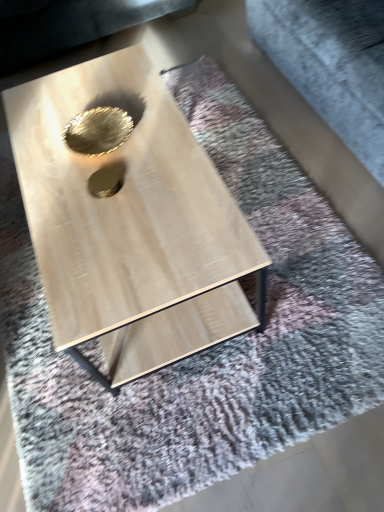
Question: Is gold metallic hole at center, the 2th hole in the back-to-front sequence, located within light wood/texture coffee table at center?

Choices:
 (A) yes
 (B) no

Answer: (A)

Question: From a real-world perspective, is light wood/texture coffee table at center physically above gold metallic hole at center, which is the second hole in top-to-bottom order?

Choices:
 (A) no
 (B) yes

Answer: (A)

Question: Is light wood/texture coffee table at center placed right next to gold metallic hole at center, placed as the 1th hole when sorted from bottom to top?

Choices:
 (A) yes
 (B) no

Answer: (B)

Question: Does light wood/texture coffee table at center appear on the right side of gold metallic hole at center, placed as the 1th hole when sorted from bottom to top?

Choices:
 (A) no
 (B) yes

Answer: (B)

Question: Is light wood/texture coffee table at center taller than gold metallic hole at center, which is the second hole in top-to-bottom order?

Choices:
 (A) yes
 (B) no

Answer: (A)

Question: From a real-world perspective, is light wood/texture coffee table at center located beneath gold metallic hole at center, placed as the 1th hole when sorted from bottom to top?

Choices:
 (A) yes
 (B) no

Answer: (A)

Question: Can you confirm if light wood/texture coffee table at center is shorter than gray fabric at upper right?

Choices:
 (A) no
 (B) yes

Answer: (B)

Question: Is light wood/texture coffee table at center smaller than gray fabric at upper right?

Choices:
 (A) no
 (B) yes

Answer: (B)

Question: Is light wood/texture coffee table at center positioned beyond the bounds of gray fabric at upper right?

Choices:
 (A) yes
 (B) no

Answer: (A)

Question: Can you see light wood/texture coffee table at center touching gray fabric at upper right?

Choices:
 (A) no
 (B) yes

Answer: (A)

Question: Does light wood/texture coffee table at center have a lesser width compared to gray fabric at upper right?

Choices:
 (A) yes
 (B) no

Answer: (A)

Question: Does light wood/texture coffee table at center come behind gray fabric at upper right?

Choices:
 (A) yes
 (B) no

Answer: (B)

Question: Considering the relative sizes of gold metallic hole at center, the first hole positioned from the front, and gray fabric at upper right in the image provided, is gold metallic hole at center, the first hole positioned from the front, shorter than gray fabric at upper right?

Choices:
 (A) no
 (B) yes

Answer: (B)